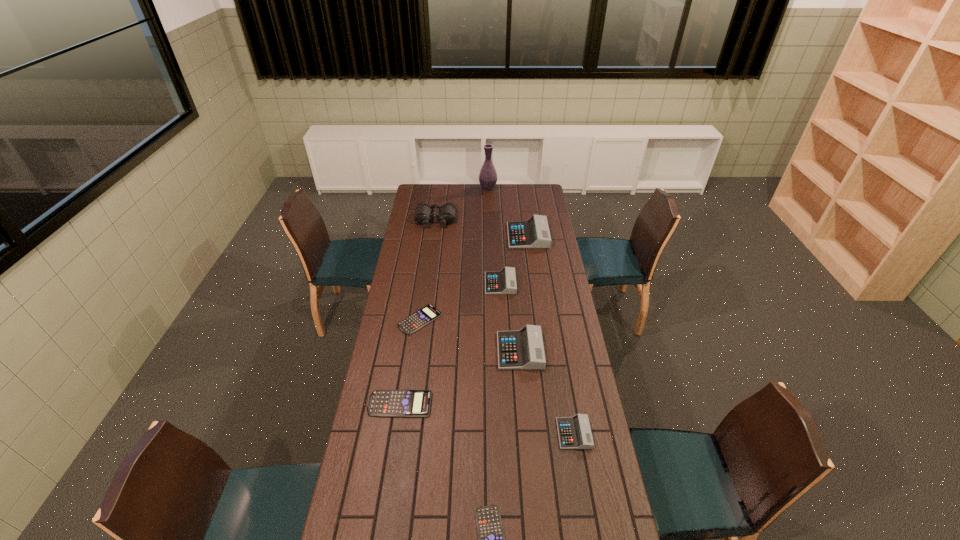
Identify the location of free spot between the farthest gray calculator and the farthest object. (508, 212).

Where is `free space that is in between the eighth farthest object and the farthest calculator`? The height and width of the screenshot is (540, 960). free space that is in between the eighth farthest object and the farthest calculator is located at coordinates (551, 335).

Image resolution: width=960 pixels, height=540 pixels. What are the coordinates of `free space between the farthest blue calculator and the third smallest gray calculator` in the screenshot? It's located at pos(470,335).

The width and height of the screenshot is (960, 540). Identify the location of blank region between the second tallest calculator and the eighth tallest object. [x=470, y=335].

Find the location of a particular element. empty space between the smallest gray calculator and the second biggest gray calculator is located at coordinates (547, 392).

Identify which object is the fourth closest to the second nearest calculator. Please provide its 2D coordinates. Your answer should be formatted as a tuple, i.e. [(x, y)], where the tuple contains the x and y coordinates of a point satisfying the conditions above.

[(417, 320)]

Find the location of a particular element. Image resolution: width=960 pixels, height=540 pixels. object that is the fifth closest to the nearest gray calculator is located at coordinates (503, 282).

Select which calculator is the third closest to the second shortest calculator. Please provide its 2D coordinates. Your answer should be formatted as a tuple, i.e. [(x, y)], where the tuple contains the x and y coordinates of a point satisfying the conditions above.

[(384, 403)]

Identify which calculator is the fifth closest to the second tallest object. Please provide its 2D coordinates. Your answer should be formatted as a tuple, i.e. [(x, y)], where the tuple contains the x and y coordinates of a point satisfying the conditions above.

[(384, 403)]

Point out which gray calculator is positioned as the second nearest to the fifth tallest calculator. Please provide its 2D coordinates. Your answer should be formatted as a tuple, i.e. [(x, y)], where the tuple contains the x and y coordinates of a point satisfying the conditions above.

[(574, 432)]